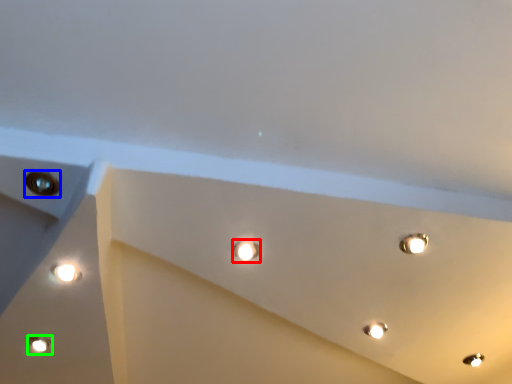
Question: Which object is the farthest from droplight (highlighted by a red box)? Choose among these: hole (highlighted by a blue box) or lamp (highlighted by a green box).

Choices:
 (A) hole
 (B) lamp

Answer: (B)